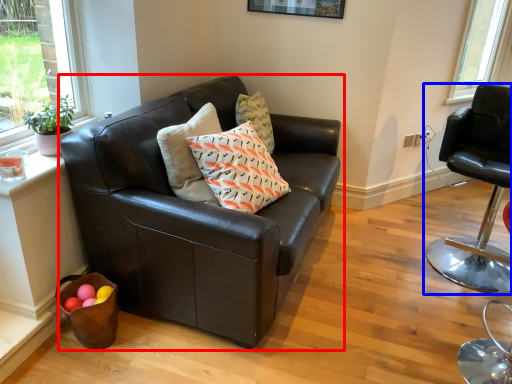
Question: Among these objects, which one is nearest to the camera, studio couch (highlighted by a red box) or chair (highlighted by a blue box)?

Choices:
 (A) studio couch
 (B) chair

Answer: (A)